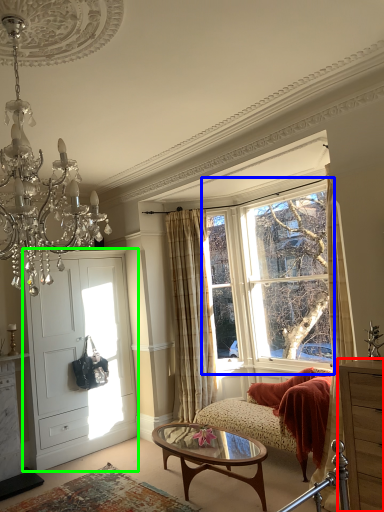
Question: Based on their relative distances, which object is nearer to cabinetry (highlighted by a red box)? Choose from window (highlighted by a blue box) and door (highlighted by a green box).

Choices:
 (A) window
 (B) door

Answer: (A)